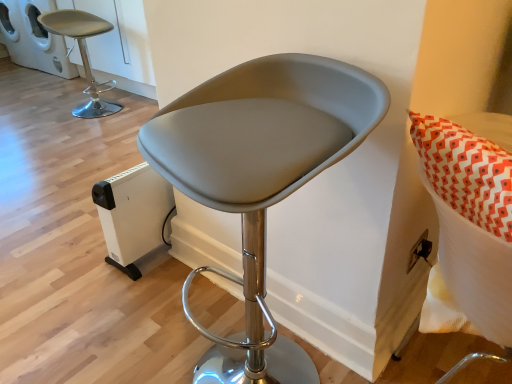
At what (x,y) coordinates should I click in order to perform the action: click on vacant area that is in front of white plastic heater at lower left, placed as the second appliance when sorted from top to bottom. Please return your answer as a coordinate pair (x, y). Looking at the image, I should click on (131, 296).